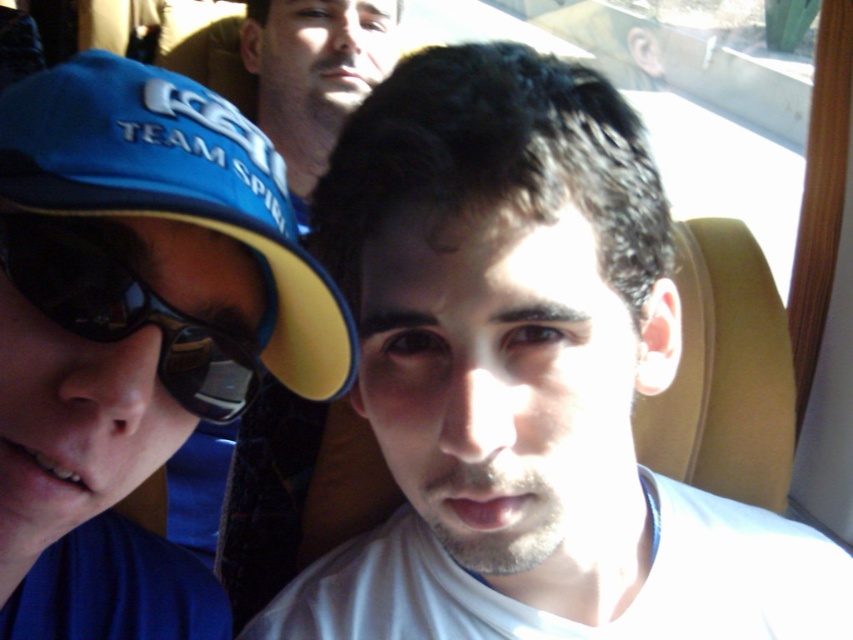
You are a photographer trying to capture a clear photo of the white matte shirt at center and the black reflective sunglasses at left. Since the sunlight is causing glare, which object should you adjust your camera angle to avoid the glare first?

The black reflective sunglasses at left should be adjusted first because they are located above the white matte shirt at center and thus more likely to be in the direct path of the sunlight causing glare.

You are a photographer trying to capture a closeup of the black reflective sunglasses at left and the matte blue shirt at upper center. Since the camera can only focus on one object at a time, which object should you choose to ensure it fills the frame more effectively?

The matte blue shirt at upper center should be chosen because it has a greater width than the black reflective sunglasses at left, allowing it to fill the camera frame more effectively.

You are a photographer trying to capture a clear photo of the white matte shirt at center and the blue fabric baseball cap at left. Since the sunlight is causing glare, which object should you adjust your camera angle to focus on first to avoid the glare?

The blue fabric baseball cap at left is behind the white matte shirt at center, so focusing on the white matte shirt at center first would help avoid the glare since it is closer to the camera.